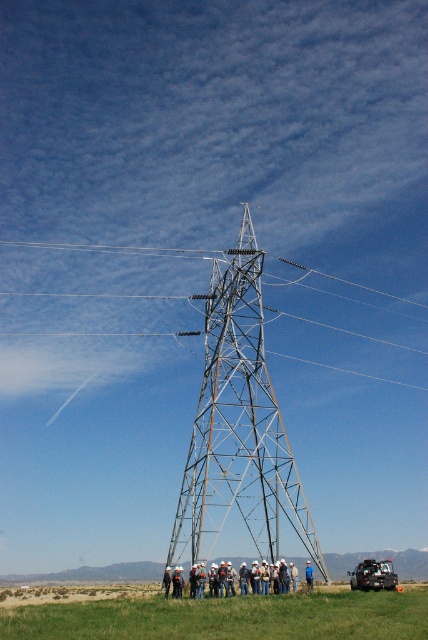
This screenshot has height=640, width=428. What do you see at coordinates (238, 424) in the screenshot?
I see `metallic silver tower at center` at bounding box center [238, 424].

Which is more to the right, metallic silver tower at center or green grassy field at lower center?

From the viewer's perspective, metallic silver tower at center appears more on the right side.

Where is `metallic silver tower at center`? This screenshot has width=428, height=640. metallic silver tower at center is located at coordinates (238, 424).

Which of these two, green grassy field at lower center or white hard hat at lower center, stands shorter?

With less height is green grassy field at lower center.

This screenshot has width=428, height=640. In order to click on green grassy field at lower center in this screenshot , I will do 228,616.

What do you see at coordinates (228, 616) in the screenshot?
I see `green grassy field at lower center` at bounding box center [228, 616].

The image size is (428, 640). I want to click on green grassy field at lower center, so [x=228, y=616].

Between green grassy field at lower center and brushed metal jeep at lower center, which one is positioned lower?

green grassy field at lower center

Can you confirm if green grassy field at lower center is positioned below brushed metal jeep at lower center?

Indeed, green grassy field at lower center is positioned under brushed metal jeep at lower center.

I want to click on green grassy field at lower center, so click(228, 616).